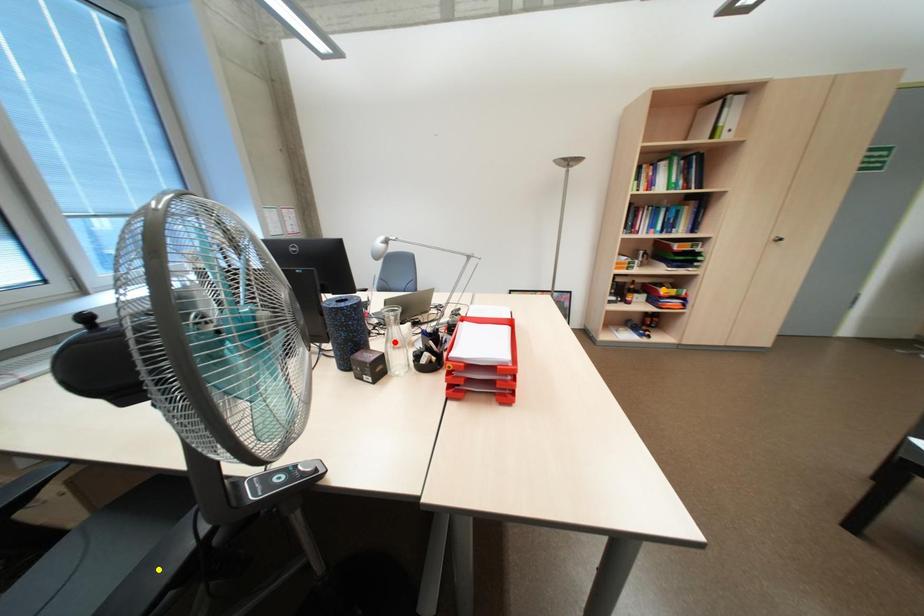
Order these from nearest to farthest:
1. yellow point
2. orange point
3. red point

1. yellow point
2. red point
3. orange point